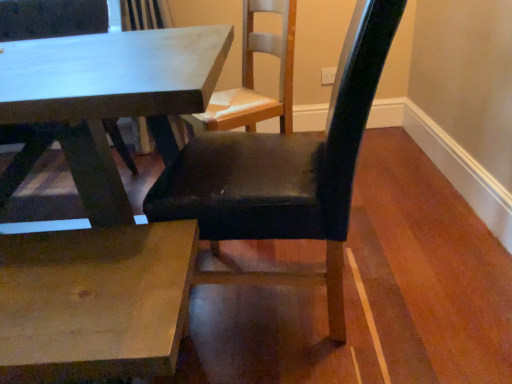
Question: Looking at the image, does black leather chair at center seem bigger or smaller compared to smooth white table at center?

Choices:
 (A) small
 (B) big

Answer: (A)

Question: Would you say black leather chair at center is to the left or to the right of smooth white table at center in the picture?

Choices:
 (A) right
 (B) left

Answer: (A)

Question: Is point (336, 175) positioned closer to the camera than point (93, 172)?

Choices:
 (A) farther
 (B) closer

Answer: (B)

Question: Which is correct: smooth white table at center is inside black leather chair at center, or outside of it?

Choices:
 (A) outside
 (B) inside

Answer: (A)

Question: Based on their positions, is smooth white table at center located to the left or right of black leather chair at center?

Choices:
 (A) right
 (B) left

Answer: (B)

Question: Is smooth white table at center bigger or smaller than black leather chair at center?

Choices:
 (A) small
 (B) big

Answer: (B)

Question: Relative to black leather chair at center, is smooth white table at center in front or behind?

Choices:
 (A) behind
 (B) front

Answer: (A)